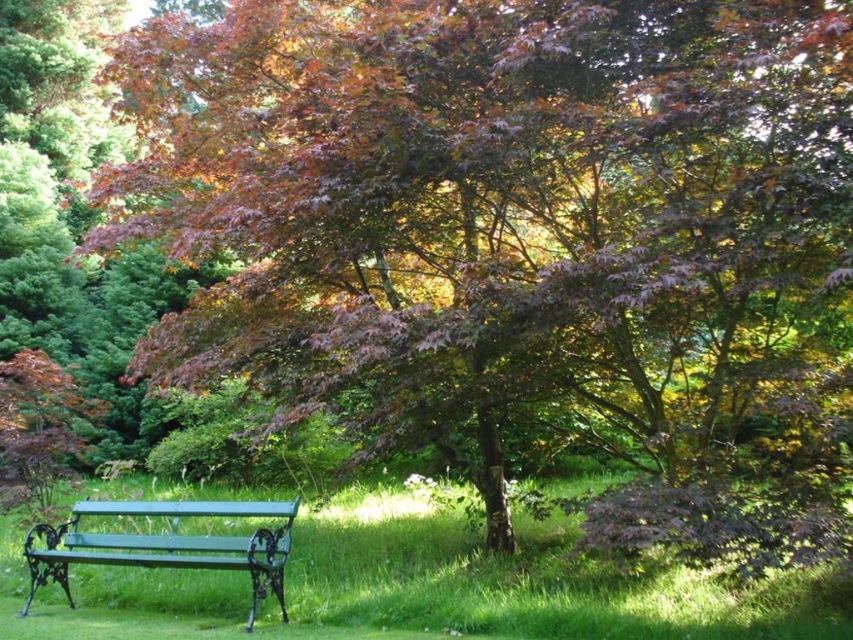
You are a gardener who needs to place a new flower pot that is 2 meters wide between the green grass at lower left and the green painted metal bench at lower left. Can you fit it there?

The green grass at lower left and green painted metal bench at lower left are 2.63 meters apart from each other. Since the flower pot is 2 meters wide, it can fit between them as the distance is greater than the pot width.

You are standing in the garden and want to sit on the green painted metal bench at lower left. Can you see the top of the green grass at lower left from your seated position?

The green grass at lower left is not as tall as the green painted metal bench at lower left, so yes, you can see the top of the green grass at lower left from your seated position on the bench.

You are standing at the green bench with ornate black metal supports and looking towards the large tree with thick trunk and branches. There is a point marked at coordinates (525, 582). What is located at that point?

At point (525, 582) lies green grass at lower left.